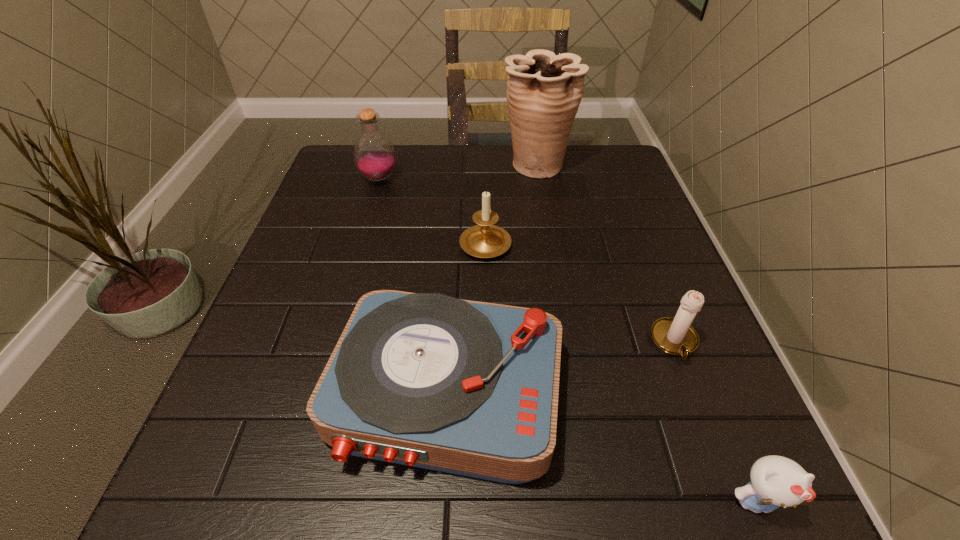
In order to click on vacant space located with a handle on the side of the farther candle holder in this screenshot , I will do `click(484, 157)`.

Locate an element on the screen. This screenshot has height=540, width=960. free space located with a handle on the side of the farther candle holder is located at coordinates (485, 198).

Identify the location of vacant area situated 0.100m on the handle side of the nearer candle holder. 705,421.

Find the location of a particular element. The image size is (960, 540). free space located on the right of the record player is located at coordinates coord(716,391).

Find the location of a particular element. urn situated at the far edge is located at coordinates (544, 91).

Find the location of `bottle at the far edge`. bottle at the far edge is located at coordinates (374, 155).

Where is `record player that is positioned at the near edge`? The image size is (960, 540). record player that is positioned at the near edge is located at coordinates (471, 388).

At what (x,y) coordinates should I click in order to perform the action: click on kitten located in the near edge section of the desktop. Please return your answer as a coordinate pair (x, y). Looking at the image, I should click on [776, 481].

Find the location of `object that is at the left edge`. object that is at the left edge is located at coordinates (374, 155).

Image resolution: width=960 pixels, height=540 pixels. What are the coordinates of `urn at the right edge` in the screenshot? It's located at (544, 91).